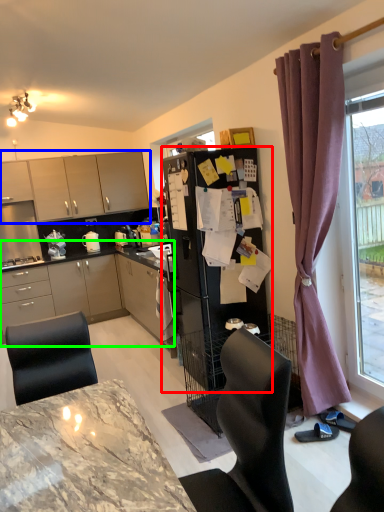
Question: Which object is the farthest from refrigerator (highlighted by a red box)? Choose among these: cabinetry (highlighted by a blue box) or cabinetry (highlighted by a green box).

Choices:
 (A) cabinetry
 (B) cabinetry

Answer: (A)